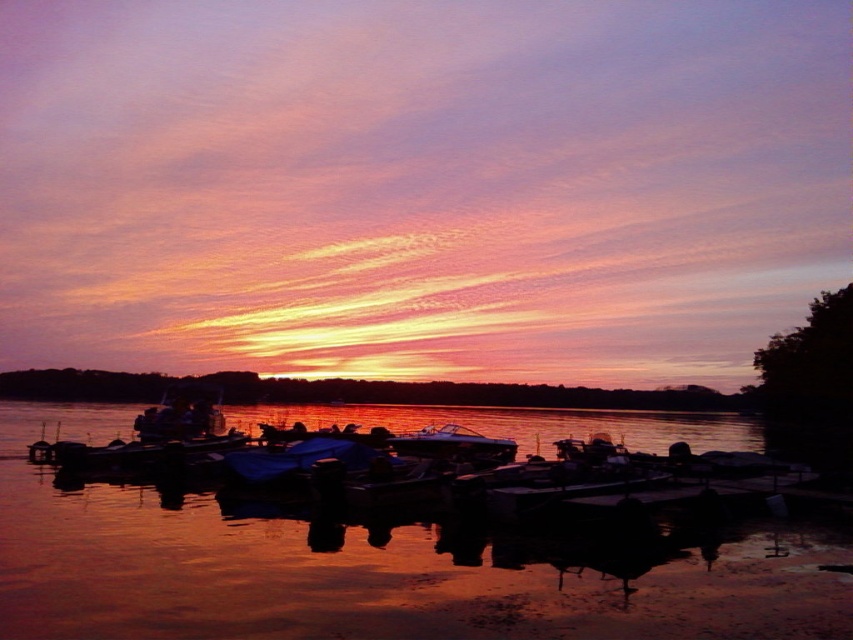
Does glossy water at center lie in front of glossy white boat at center?

That is True.

Who is more distant from viewer, (x=109, y=512) or (x=468, y=440)?

The point (x=468, y=440) is behind.

Where is `glossy water at center`? glossy water at center is located at coordinates (367, 570).